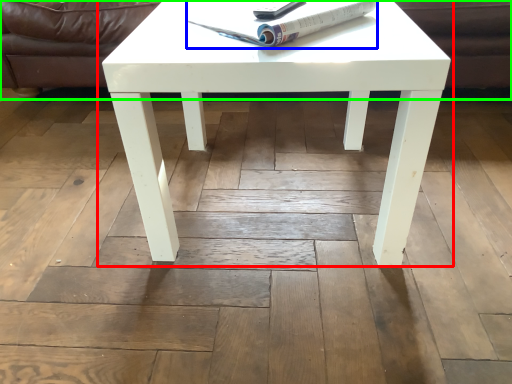
Question: Based on their relative distances, which object is farther from coffee table (highlighted by a red box)? Choose from magazine (highlighted by a blue box) and couch (highlighted by a green box).

Choices:
 (A) magazine
 (B) couch

Answer: (B)